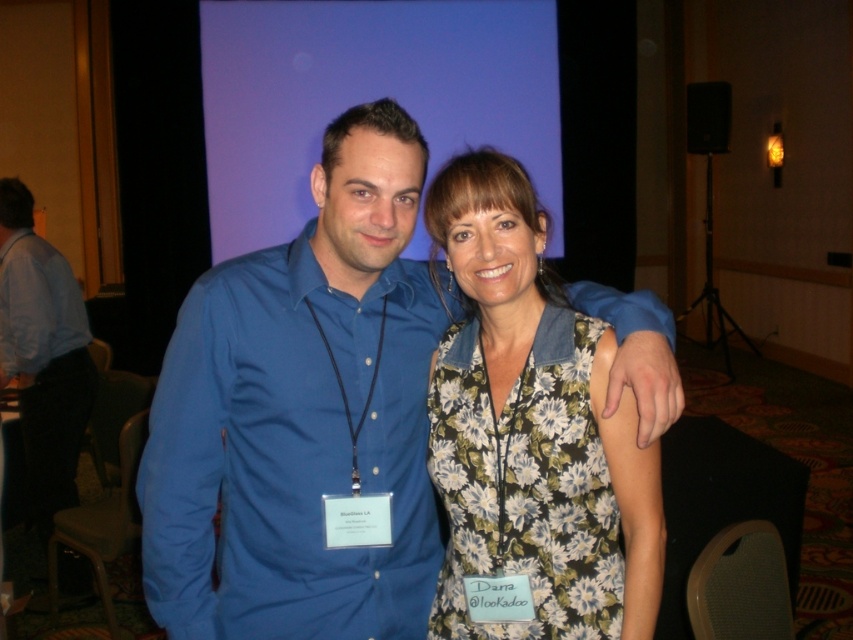
You are at a conference and need to find the person wearing the matte blue shirt at center. Based on the scene description, where should you look relative to the light blue cotton shirt at left?

The matte blue shirt at center is located below the light blue cotton shirt at left, so you should look downward from the light blue cotton shirt at left to find the matte blue shirt at center.

You are standing in a conference hall and want to take a photo of the point at coordinates (375,256). Your camera has a focal length of 50mm and you are currently 2 meters away from the point. Should you move closer or farther away to focus properly?

The distance of point (375,256) from camera is 1.31 meters. Since you are currently 2 meters away, you should move closer to 1.31 meters to focus properly.